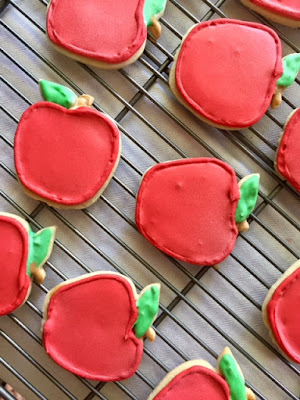
Find the location of a particular element. This screenshot has height=400, width=300. rack for heating is located at coordinates (234, 315).